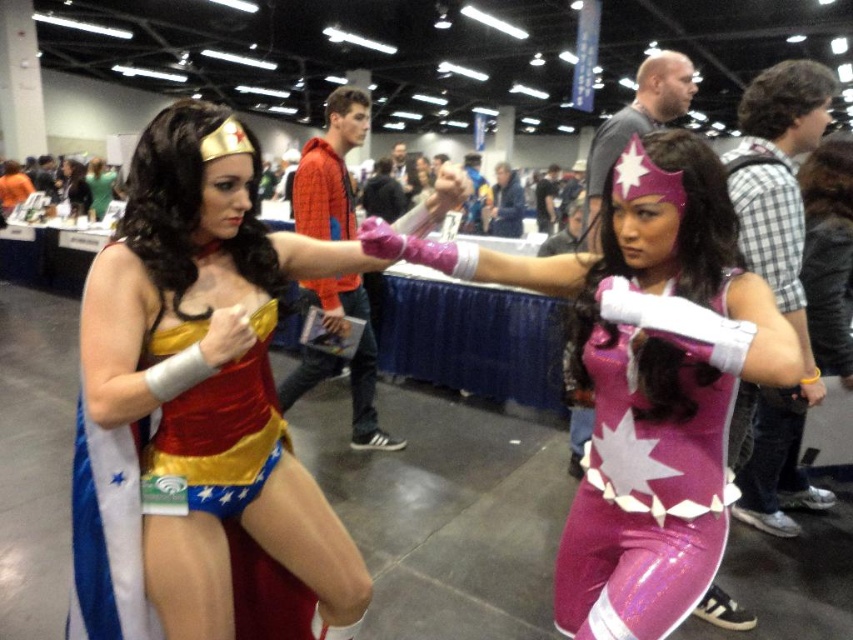
You are a photographer at the event and need to frame a shot that includes both the shiny satin costume at center and the purple glossy bodysuit at center. Considering their widths, which costume should you position closer to the edge of the frame to avoid overcrowding?

The shiny satin costume at center is wider than the purple glossy bodysuit at center, so positioning the shiny satin costume at center closer to the edge of the frame would help prevent overcrowding.

You are a photographer at the event and want to ensure both the purple glossy costume at center and the matte gold headband at center are clearly visible in your photo. Given their sizes, which object should you focus on first to ensure proper framing?

The purple glossy costume at center is smaller than the matte gold headband at center. To ensure proper framing, focus on the smaller purple glossy costume at center first to capture its details before adjusting for the larger matte gold headband at center.